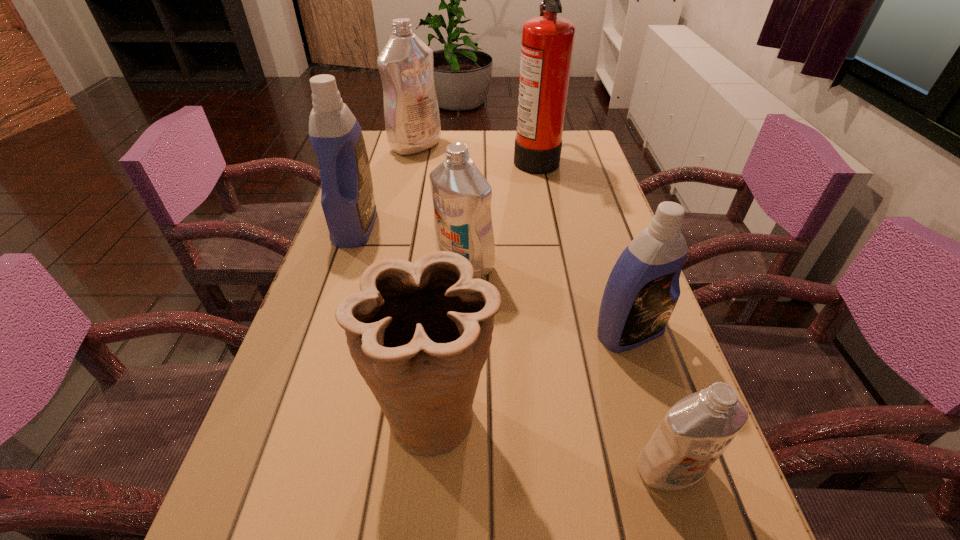
At what (x,y) coordinates should I click in order to perform the action: click on free space located 0.150m on the right of the urn. Please return your answer as a coordinate pair (x, y). Looking at the image, I should click on point(585,413).

At what (x,y) coordinates should I click in order to perform the action: click on blank space located on the back of the shortest detergent. Please return your answer as a coordinate pair (x, y). Looking at the image, I should click on (650, 406).

Image resolution: width=960 pixels, height=540 pixels. In order to click on fire extinguisher located in the far edge section of the desktop in this screenshot , I will do `click(547, 45)`.

At what (x,y) coordinates should I click in order to perform the action: click on detergent located in the far edge section of the desktop. Please return your answer as a coordinate pair (x, y). The image size is (960, 540). Looking at the image, I should click on (412, 120).

Locate an element on the screen. Image resolution: width=960 pixels, height=540 pixels. fire extinguisher located at the right edge is located at coordinates (547, 45).

I want to click on object present at the far left corner, so click(x=412, y=120).

At what (x,y) coordinates should I click in order to perform the action: click on object located at the far right corner. Please return your answer as a coordinate pair (x, y). This screenshot has width=960, height=540. Looking at the image, I should click on (547, 45).

Locate an element on the screen. free space at the far edge of the desktop is located at coordinates (497, 150).

Where is `free space at the left edge of the desktop`? This screenshot has height=540, width=960. free space at the left edge of the desktop is located at coordinates (295, 384).

The image size is (960, 540). In the image, there is a desktop. In order to click on vacant region at the right edge in this screenshot , I will do `click(610, 412)`.